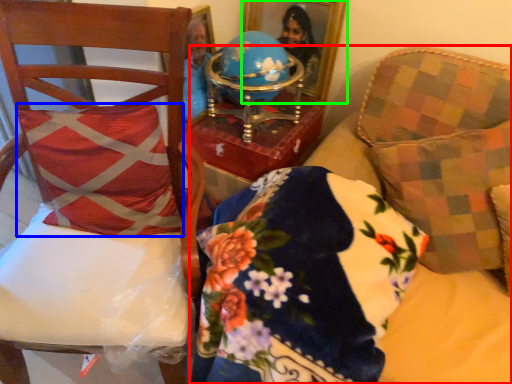
Question: Considering the real-world distances, which object is farthest from furniture (highlighted by a red box)? throw pillow (highlighted by a blue box) or picture frame (highlighted by a green box)?

Choices:
 (A) throw pillow
 (B) picture frame

Answer: (B)